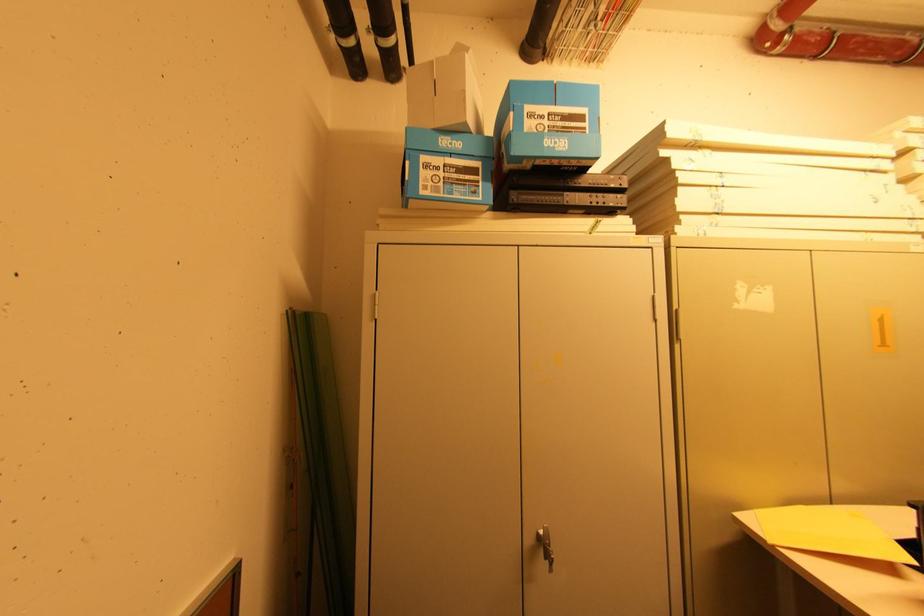
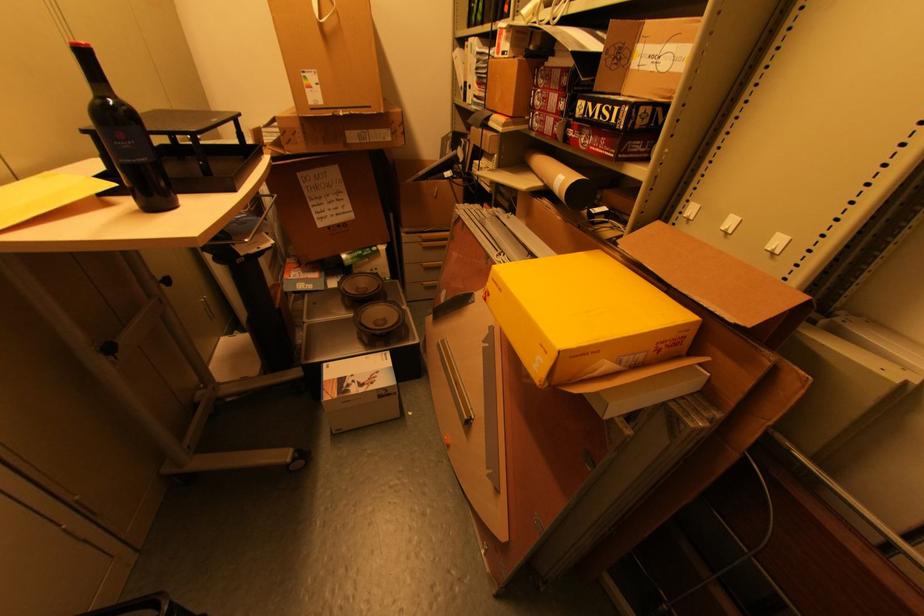
The images are taken continuously from a first-person perspective. In which direction is your viewpoint rotating?

The camera rotated toward right-down.